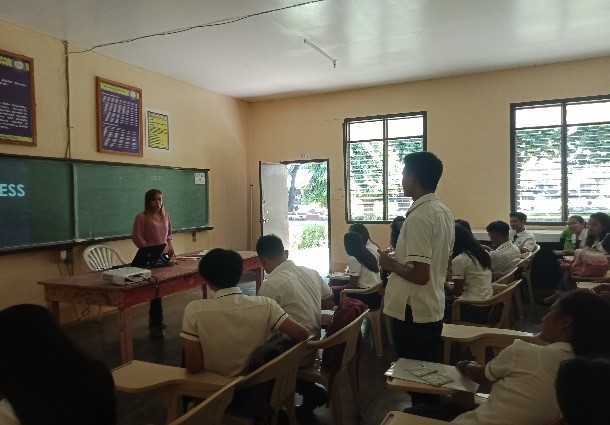
Where is `ceiling`? The width and height of the screenshot is (610, 425). ceiling is located at coordinates (457, 35).